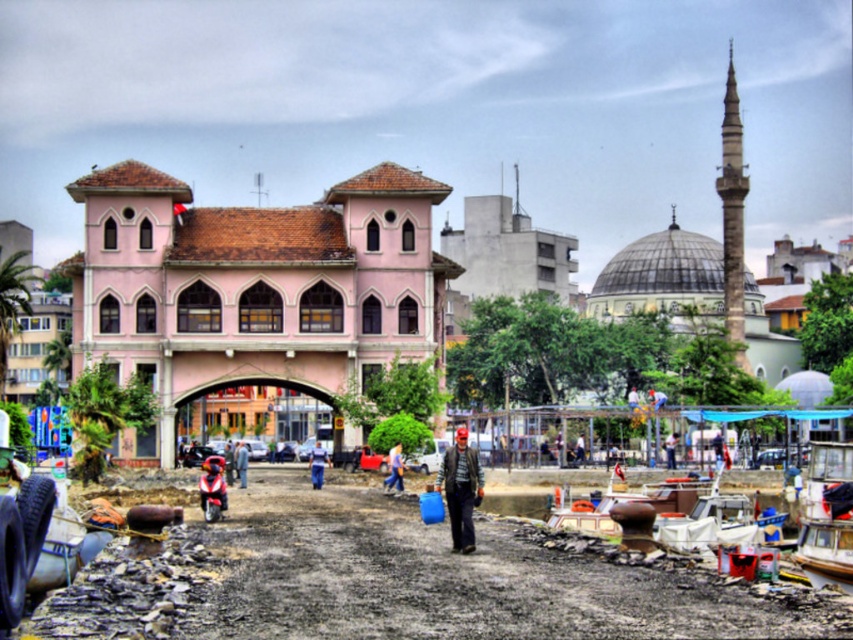
You are a tourist standing on the dirt path leading to the pink building. You see a wooden boat at lower right and blue fabric pants at center. Which object is closer to the pink building?

The blue fabric pants at center is closer to the pink building because the wooden boat at lower right is positioned on the right side of blue fabric pants at center, placing the pants between the boat and the building.

You are standing at the entrance of the mosque to the right of the image and want to walk directly towards the pink matte building at center. Based on the coordinates provided, in which direction should you head?

The pink matte building at center is located at coordinates point (252, 288), so you should head towards the left direction from the mosque to reach it.